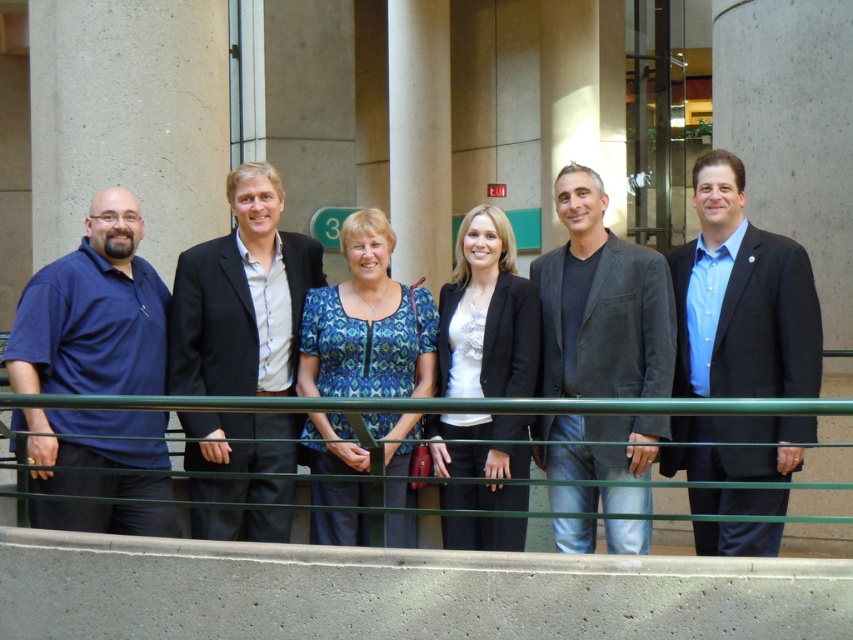
Can you confirm if matte blue polo shirt at left is shorter than dark gray blazer at center?

Yes.

Does matte blue polo shirt at left appear on the right side of dark gray blazer at center?

Incorrect, matte blue polo shirt at left is not on the right side of dark gray blazer at center.

Which is behind, point (97, 301) or point (575, 456)?

Point (575, 456)

Where is `matte blue polo shirt at left`? The height and width of the screenshot is (640, 853). matte blue polo shirt at left is located at coordinates (93, 312).

Is blue patterned blouse at center to the left of green glass rail at center from the viewer's perspective?

Indeed, blue patterned blouse at center is positioned on the left side of green glass rail at center.

Is blue patterned blouse at center to the right of green glass rail at center from the viewer's perspective?

Incorrect, blue patterned blouse at center is not on the right side of green glass rail at center.

Which is in front, point (425, 304) or point (759, 406)?

Positioned in front is point (759, 406).

Locate an element on the screen. This screenshot has height=640, width=853. blue patterned blouse at center is located at coordinates 367,324.

The height and width of the screenshot is (640, 853). Find the location of `blue shirt at center`. blue shirt at center is located at coordinates (741, 298).

Find the location of a particular element. blue shirt at center is located at coordinates (741, 298).